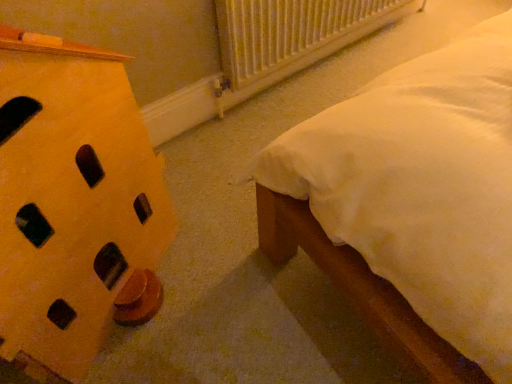
Where is `free region under white plastic radiator at upper center (from a real-world perspective)`? free region under white plastic radiator at upper center (from a real-world perspective) is located at coordinates (318, 69).